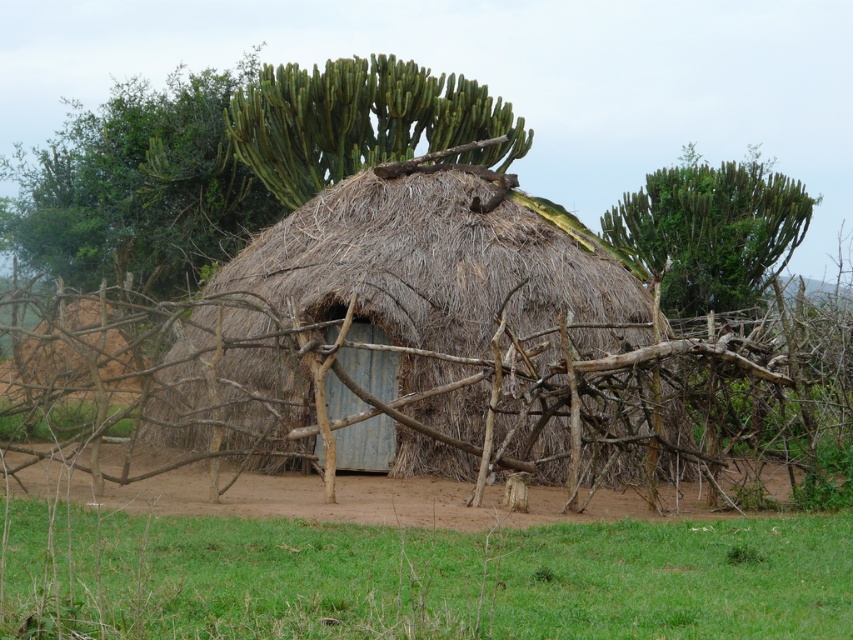
Does green spiky cactus at upper left lie in front of green spiky cactus at upper right?

No, it is behind green spiky cactus at upper right.

Can you confirm if green spiky cactus at upper left is bigger than green spiky cactus at upper right?

Indeed, green spiky cactus at upper left has a larger size compared to green spiky cactus at upper right.

What do you see at coordinates (138, 188) in the screenshot? I see `green spiky cactus at upper left` at bounding box center [138, 188].

This screenshot has height=640, width=853. I want to click on green spiky cactus at upper left, so click(138, 188).

Which is more to the left, thatched straw hut at center or green spiky cactus at upper left?

green spiky cactus at upper left is more to the left.

Is thatched straw hut at center bigger than green spiky cactus at upper left?

No, thatched straw hut at center is not bigger than green spiky cactus at upper left.

Between point (509, 232) and point (119, 112), which one is positioned behind?

The point (119, 112) is more distant.

Image resolution: width=853 pixels, height=640 pixels. What are the coordinates of `thatched straw hut at center` in the screenshot? It's located at (401, 330).

Does point (589, 339) come closer to viewer compared to point (730, 300)?

Yes.

Which is behind, point (193, 381) or point (784, 186)?

Positioned behind is point (784, 186).

Who is more distant from viewer, [157,410] or [718,308]?

The point [718,308] is more distant.

You are a GUI agent. You are given a task and a screenshot of the screen. Output one action in this format:
    pyautogui.click(x=<x>, y=<y>)
    Task: Click on the thatched straw hut at center
    
    Given the screenshot: What is the action you would take?
    (401, 330)